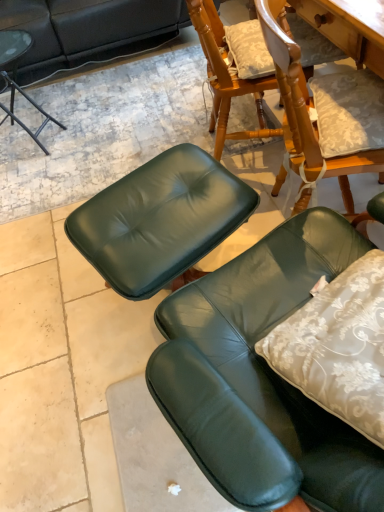
Locate an element on the screen. Image resolution: width=384 pixels, height=512 pixels. vacant area situated below matte black side table at upper left, positioned as the first chair in top-to-bottom order (from a real-world perspective) is located at coordinates (31, 139).